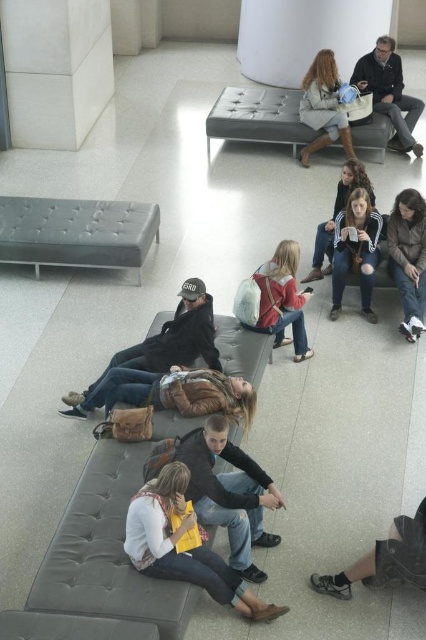
Who is positioned more to the right, matte black jacket at upper right or matte beige coat at center?

matte black jacket at upper right is more to the right.

Image resolution: width=426 pixels, height=640 pixels. Describe the element at coordinates (388, 92) in the screenshot. I see `matte black jacket at upper right` at that location.

Between point (379, 83) and point (310, 84), which one is positioned behind?

Positioned behind is point (379, 83).

Where is `matte black jacket at upper right`? This screenshot has height=640, width=426. matte black jacket at upper right is located at coordinates (388, 92).

Is white textured backpack at center to the right of white adidas hoodie at center from the viewer's perspective?

Incorrect, white textured backpack at center is not on the right side of white adidas hoodie at center.

Between point (282, 266) and point (350, 205), which one is positioned in front?

Point (282, 266)

I want to click on white textured backpack at center, so click(x=276, y=300).

Can you confirm if brown leather jacket at right is smaller than white adidas hoodie at center?

Actually, brown leather jacket at right might be larger than white adidas hoodie at center.

Is brown leather jacket at right further to the viewer compared to white adidas hoodie at center?

No, it is in front of white adidas hoodie at center.

Which is behind, point (412, 188) or point (365, 250)?

The point (365, 250) is behind.

The image size is (426, 640). Identify the location of brown leather jacket at right. (408, 257).